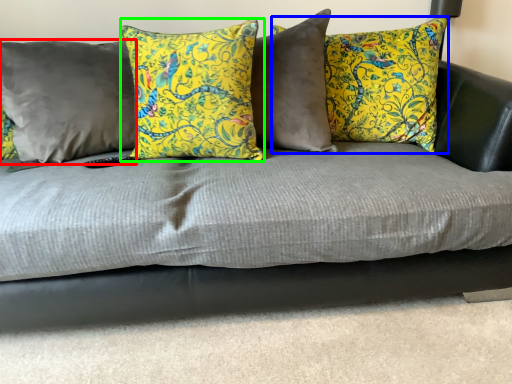
Question: Which object is the farthest from pillow (highlighted by a red box)? Choose among these: pillow (highlighted by a blue box) or pillow (highlighted by a green box).

Choices:
 (A) pillow
 (B) pillow

Answer: (A)